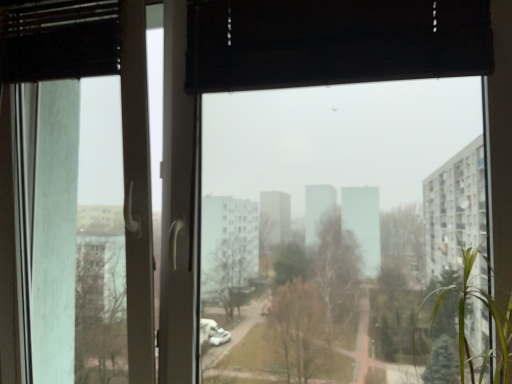
Question: Is transparent glass window at center shorter than transparent glass screen door at left?

Choices:
 (A) no
 (B) yes

Answer: (B)

Question: Does transparent glass window at center come in front of transparent glass screen door at left?

Choices:
 (A) no
 (B) yes

Answer: (B)

Question: Is transparent glass window at center far from transparent glass screen door at left?

Choices:
 (A) no
 (B) yes

Answer: (B)

Question: Can you confirm if transparent glass window at center is wider than transparent glass screen door at left?

Choices:
 (A) no
 (B) yes

Answer: (A)

Question: From the image's perspective, is transparent glass window at center located beneath transparent glass screen door at left?

Choices:
 (A) yes
 (B) no

Answer: (B)

Question: Is green leafy plant at right to the left or to the right of transparent glass window at center in the image?

Choices:
 (A) left
 (B) right

Answer: (B)

Question: From a real-world perspective, relative to transparent glass window at center, is green leafy plant at right vertically above or below?

Choices:
 (A) below
 (B) above

Answer: (A)

Question: From the image's perspective, relative to transparent glass window at center, is green leafy plant at right above or below?

Choices:
 (A) above
 (B) below

Answer: (B)

Question: Is green leafy plant at right wider or thinner than transparent glass window at center?

Choices:
 (A) wide
 (B) thin

Answer: (A)

Question: From their relative heights in the image, would you say transparent glass window at center is taller or shorter than green leafy plant at right?

Choices:
 (A) tall
 (B) short

Answer: (A)

Question: Considering the positions of transparent glass window at center and green leafy plant at right in the image, is transparent glass window at center bigger or smaller than green leafy plant at right?

Choices:
 (A) big
 (B) small

Answer: (A)

Question: Considering the relative positions of transparent glass window at center and green leafy plant at right in the image provided, is transparent glass window at center to the left or to the right of green leafy plant at right?

Choices:
 (A) right
 (B) left

Answer: (B)

Question: Relative to green leafy plant at right, is transparent glass window at center in front or behind?

Choices:
 (A) front
 (B) behind

Answer: (B)

Question: From the image's perspective, relative to transparent glass screen door at left, is transparent glass window at center above or below?

Choices:
 (A) below
 (B) above

Answer: (B)

Question: Is point (260, 251) closer or farther from the camera than point (76, 76)?

Choices:
 (A) closer
 (B) farther

Answer: (B)